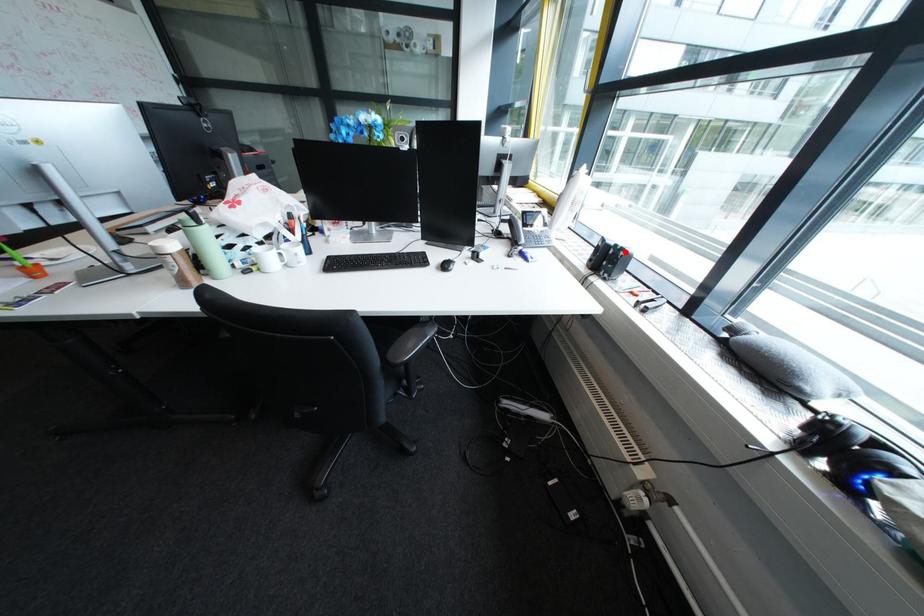
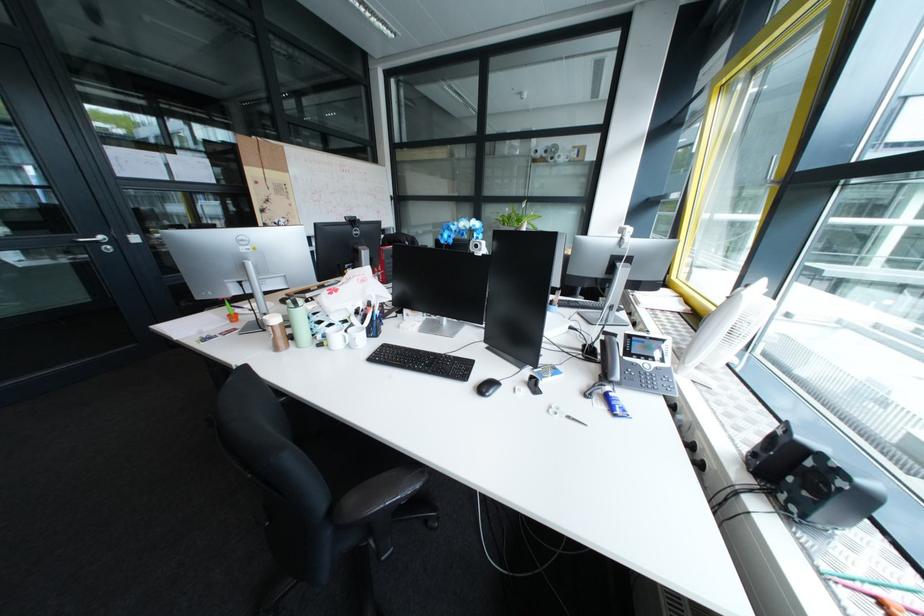
Where in the second image is the point corresponding to the highlighted location from the first image?

(823, 464)